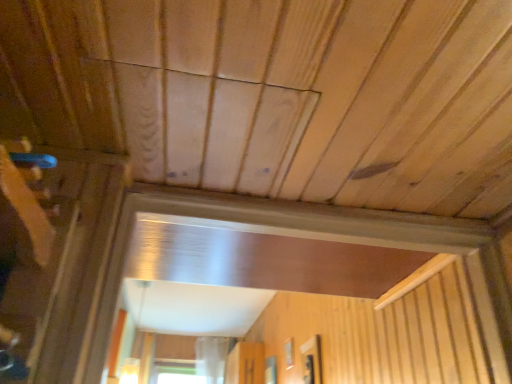
Question: Is transparent glass window at center, the 3th window positioned from the left, facing towards transparent glass window at center, which ranks as the third window in right-to-left order?

Choices:
 (A) yes
 (B) no

Answer: (B)

Question: Is transparent glass window at center, the 3th window in the back-to-front sequence, located outside transparent glass window at center, which ranks as the third window in right-to-left order?

Choices:
 (A) no
 (B) yes

Answer: (B)

Question: Considering the relative positions of transparent glass window at center, positioned as the 1th window in front-to-back order, and transparent glass window at center, which is counted as the first window, starting from the back, in the image provided, is transparent glass window at center, positioned as the 1th window in front-to-back order, in front of transparent glass window at center, which is counted as the first window, starting from the back,?

Choices:
 (A) no
 (B) yes

Answer: (B)

Question: Can you confirm if transparent glass window at center, the 3th window in the back-to-front sequence, is bigger than transparent glass window at center, the third window from the front?

Choices:
 (A) no
 (B) yes

Answer: (A)

Question: Does transparent glass window at center, the 3th window positioned from the left, have a smaller size compared to transparent glass window at center, which is counted as the first window, starting from the back?

Choices:
 (A) yes
 (B) no

Answer: (A)

Question: In the image, is transparent glass window at center, which is the first window from left to right, positioned in front of or behind transparent glass window at center, which is the 1th window in right-to-left order?

Choices:
 (A) front
 (B) behind

Answer: (B)

Question: Looking at their shapes, would you say transparent glass window at center, which is the first window from left to right, is wider or thinner than transparent glass window at center, which is the 1th window in right-to-left order?

Choices:
 (A) wide
 (B) thin

Answer: (A)

Question: Is transparent glass window at center, which ranks as the third window in right-to-left order, bigger or smaller than transparent glass window at center, the 3th window positioned from the left?

Choices:
 (A) big
 (B) small

Answer: (A)

Question: From the image's perspective, is transparent glass window at center, which is the first window from left to right, above or below transparent glass window at center, the 3th window positioned from the left?

Choices:
 (A) below
 (B) above

Answer: (A)

Question: Is transparent glass window at center, the second window positioned from the right, taller or shorter than transparent plastic screen door at center?

Choices:
 (A) short
 (B) tall

Answer: (A)

Question: In terms of size, does transparent glass window at center, acting as the 2th window starting from the left, appear bigger or smaller than transparent plastic screen door at center?

Choices:
 (A) small
 (B) big

Answer: (A)

Question: Based on their positions, is transparent glass window at center, which is the 2th window from front to back, located to the left or right of transparent plastic screen door at center?

Choices:
 (A) left
 (B) right

Answer: (B)

Question: From a real-world perspective, is transparent glass window at center, arranged as the second window when viewed from the back, positioned above or below transparent plastic screen door at center?

Choices:
 (A) above
 (B) below

Answer: (B)

Question: Is transparent glass window at center, positioned as the 1th window in front-to-back order, wider or thinner than transparent plastic screen door at center?

Choices:
 (A) thin
 (B) wide

Answer: (A)

Question: Is transparent glass window at center, positioned as the 1th window in front-to-back order, inside or outside of transparent plastic screen door at center?

Choices:
 (A) inside
 (B) outside

Answer: (B)